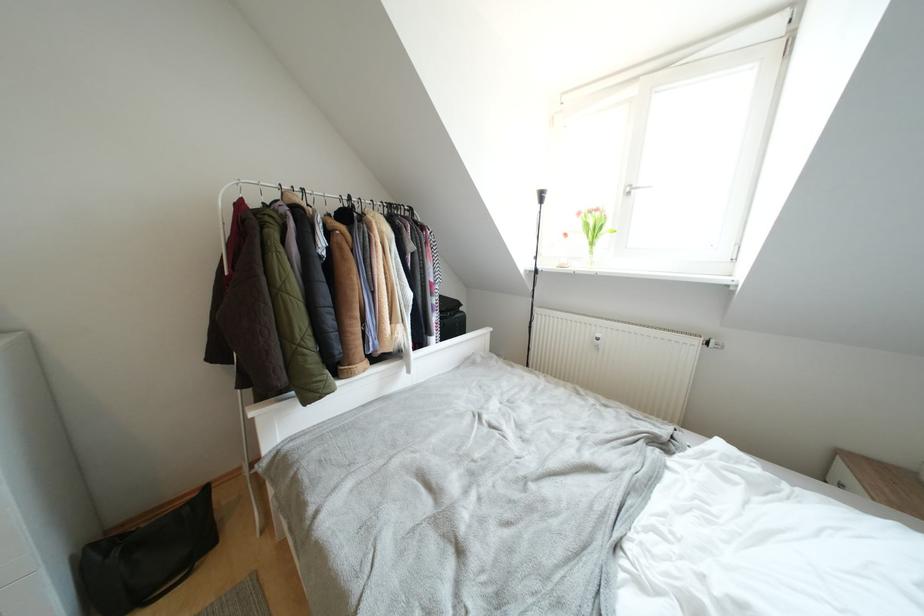
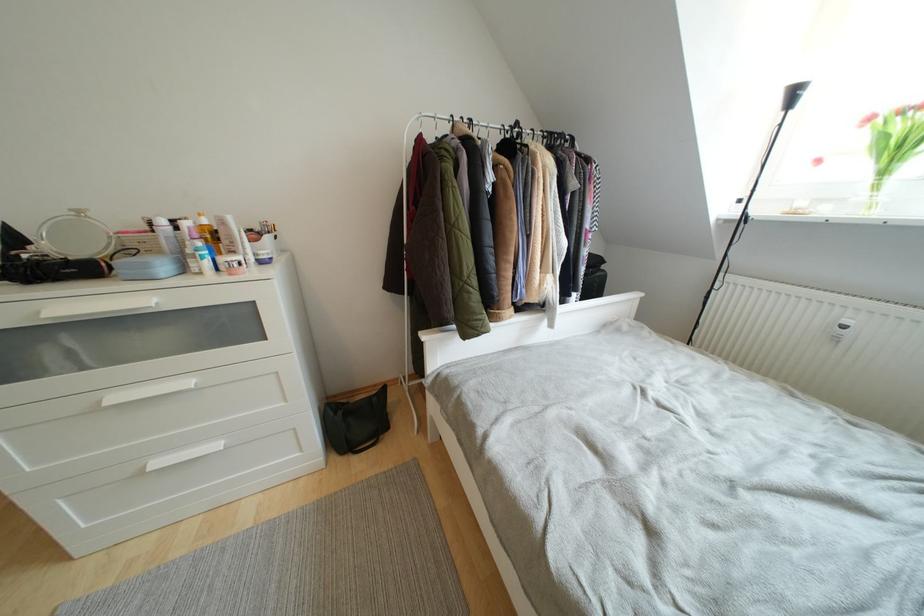
Question: Based on the continuous images, in which direction is the camera rotating? Reply with the corresponding letter.

Choices:
 (A) Left
 (B) Right
 (C) Up
 (D) Down

Answer: (A)